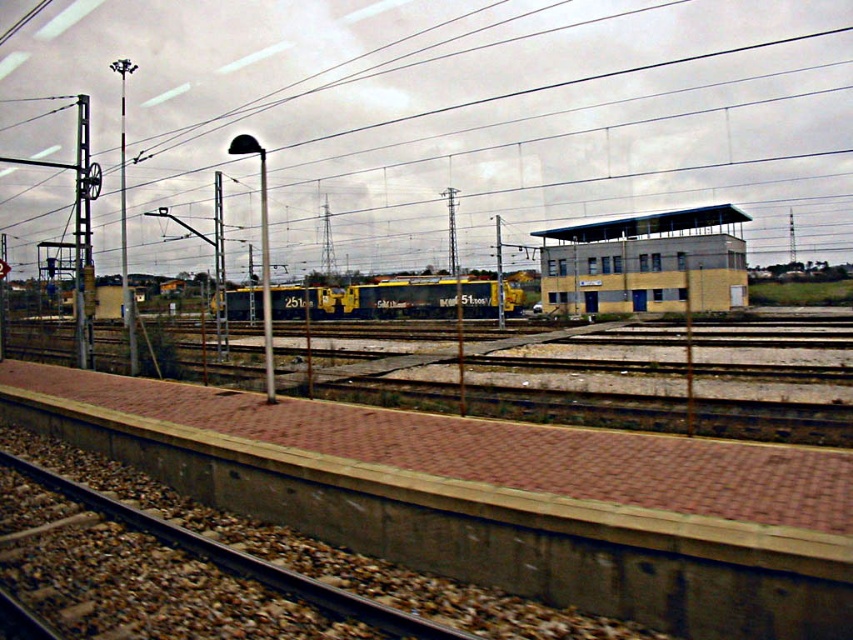
Question: Is brown gravel train track at lower left further to the viewer compared to metallic pole at center?

Choices:
 (A) yes
 (B) no

Answer: (B)

Question: Which point is closer to the camera?

Choices:
 (A) metallic pole at center
 (B) brown gravel train track at lower left
 (C) yellow concrete building at center
 (D) metallic wire at upper center

Answer: (B)

Question: Which object is positioned closest to the yellow painted metal freight train at center?

Choices:
 (A) brown gravel train track at lower left
 (B) yellow concrete building at center
 (C) metallic wire at upper center

Answer: (B)

Question: Can you confirm if brown gravel train track at lower left is positioned below metallic pole at center?

Choices:
 (A) yes
 (B) no

Answer: (A)

Question: Which object is positioned farthest from the yellow concrete building at center?

Choices:
 (A) metallic pole at center
 (B) metallic wire at upper center
 (C) brown gravel train track at lower left
 (D) yellow painted metal freight train at center

Answer: (C)

Question: Does yellow concrete building at center appear over metallic pole at center?

Choices:
 (A) yes
 (B) no

Answer: (B)